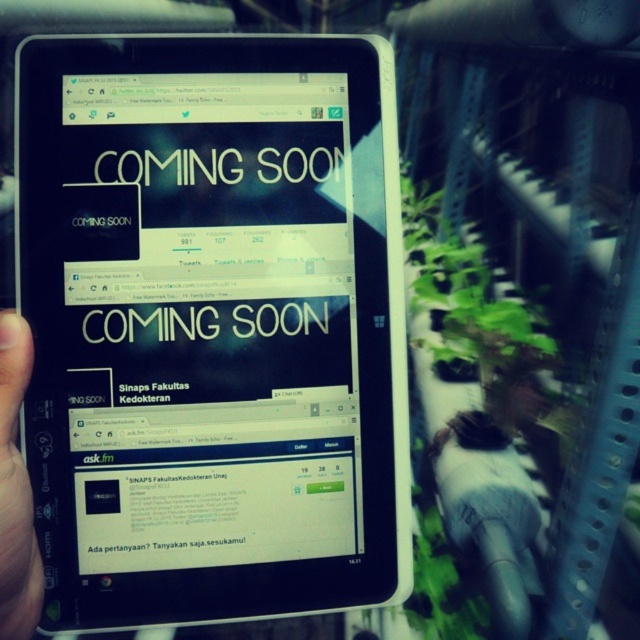
Question: Among these objects, which one is farthest from the camera?

Choices:
 (A) black glossy tablet at center
 (B) black matte tablet at left

Answer: (A)

Question: Is black glossy tablet at center thinner than black matte tablet at left?

Choices:
 (A) yes
 (B) no

Answer: (B)

Question: Which point appears farthest from the camera in this image?

Choices:
 (A) (45, 548)
 (B) (13, 358)

Answer: (A)

Question: Does black glossy tablet at center have a smaller size compared to black matte tablet at left?

Choices:
 (A) yes
 (B) no

Answer: (B)

Question: Does black glossy tablet at center appear on the left side of black matte tablet at left?

Choices:
 (A) yes
 (B) no

Answer: (B)

Question: Which object is closer to the camera taking this photo?

Choices:
 (A) black matte tablet at left
 (B) black glossy tablet at center

Answer: (A)